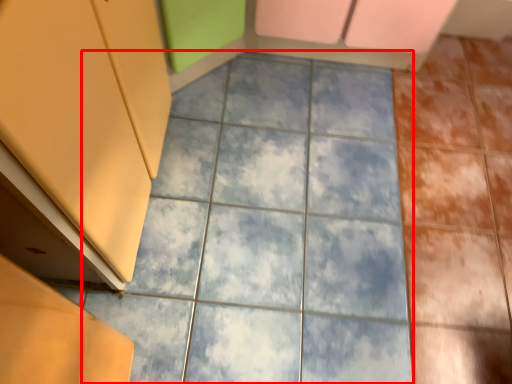
Question: From the image's perspective, considering the relative positions of ceramic tile (annotated by the red box) and cabinetry in the image provided, where is ceramic tile (annotated by the red box) located with respect to the staircase?

Choices:
 (A) below
 (B) above

Answer: (A)